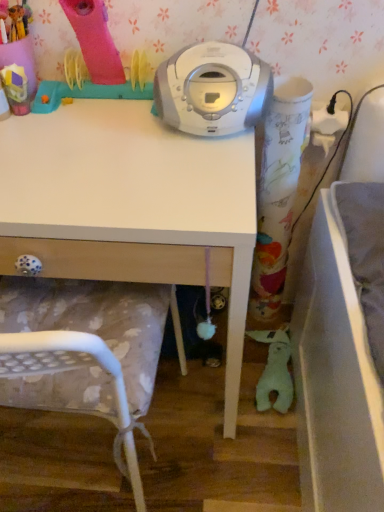
Question: Is white plastic chair at lower left positioned beyond the bounds of white plastic cd player at center?

Choices:
 (A) yes
 (B) no

Answer: (A)

Question: From a real-world perspective, is white plastic chair at lower left physically above white plastic cd player at center?

Choices:
 (A) no
 (B) yes

Answer: (A)

Question: From a real-world perspective, is white plastic chair at lower left beneath white plastic cd player at center?

Choices:
 (A) no
 (B) yes

Answer: (B)

Question: Is white plastic chair at lower left oriented towards white plastic cd player at center?

Choices:
 (A) yes
 (B) no

Answer: (B)

Question: Considering the relative sizes of white plastic chair at lower left and white plastic cd player at center in the image provided, is white plastic chair at lower left shorter than white plastic cd player at center?

Choices:
 (A) yes
 (B) no

Answer: (B)

Question: Is white plastic chair at lower left bigger than white plastic cd player at center?

Choices:
 (A) yes
 (B) no

Answer: (A)

Question: Is green plush toy at lower right, arranged as the first toy when ordered from the bottom, taller than white plastic chair at lower left?

Choices:
 (A) yes
 (B) no

Answer: (B)

Question: Is green plush toy at lower right, the 2th toy when ordered from left to right, further to the viewer compared to white plastic chair at lower left?

Choices:
 (A) no
 (B) yes

Answer: (B)

Question: Would you consider green plush toy at lower right, the 2th toy when ordered from left to right, to be distant from white plastic chair at lower left?

Choices:
 (A) yes
 (B) no

Answer: (B)

Question: From the image's perspective, does green plush toy at lower right, which ranks as the 2th toy in top-to-bottom order, appear lower than white plastic chair at lower left?

Choices:
 (A) no
 (B) yes

Answer: (B)

Question: Considering the relative positions of green plush toy at lower right, the 2th toy when ordered from left to right, and white plastic chair at lower left in the image provided, is green plush toy at lower right, the 2th toy when ordered from left to right, to the left of white plastic chair at lower left from the viewer's perspective?

Choices:
 (A) yes
 (B) no

Answer: (B)

Question: Considering the relative sizes of green plush toy at lower right, the 2th toy when ordered from left to right, and white plastic chair at lower left in the image provided, is green plush toy at lower right, the 2th toy when ordered from left to right, thinner than white plastic chair at lower left?

Choices:
 (A) no
 (B) yes

Answer: (B)

Question: Is white plastic chair at lower left at the right side of green plush toy at lower right, the 1th toy viewed from the back?

Choices:
 (A) yes
 (B) no

Answer: (B)